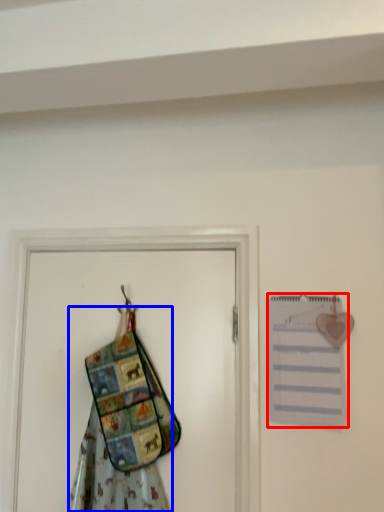
Question: Which of the following is the closest to the observer, journal (highlighted by a red box) or fancy dress (highlighted by a blue box)?

Choices:
 (A) journal
 (B) fancy dress

Answer: (B)